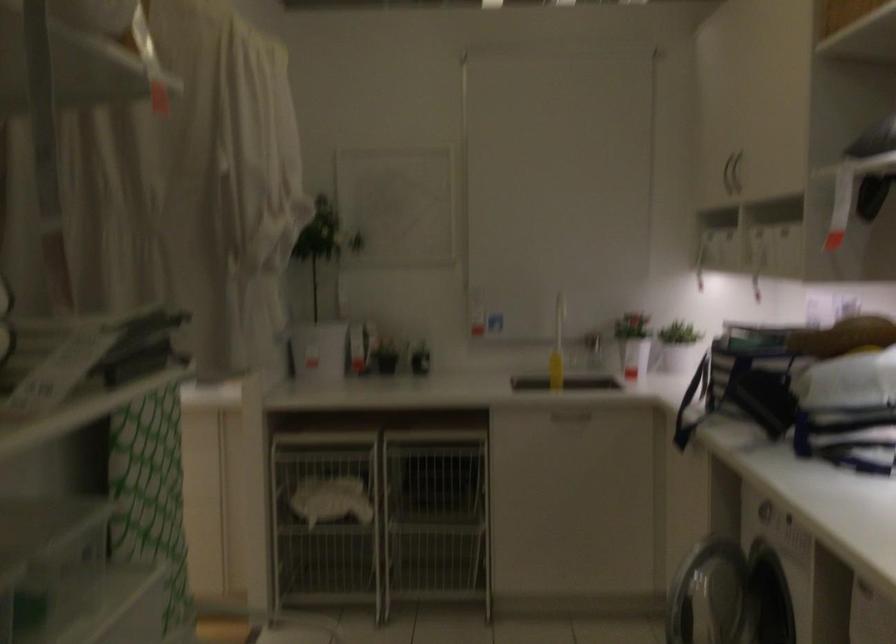
What do you see at coordinates (592, 348) in the screenshot?
I see `a faucet handle` at bounding box center [592, 348].